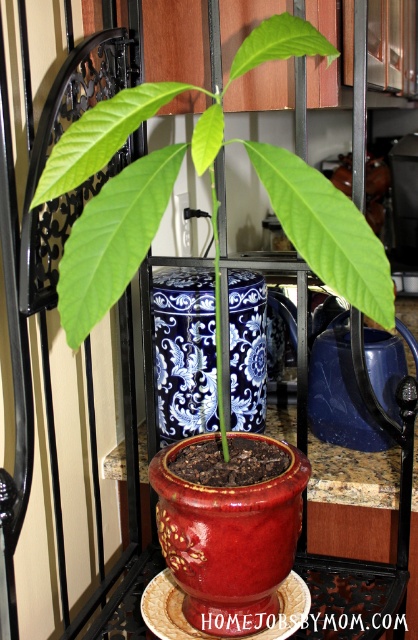
You are a delivery person who needs to place a new package on the counter between the red glossy pot at center and the blue and white porcelain vase at center. The package is 12 inches long. Can you fit it between them without moving either object?

The red glossy pot at center is 11.56 inches away from the blue and white porcelain vase at center, so the 12 inch package cannot fit between them as the distance is slightly less than the package length.

You are arranging plants in a kitchen. You have a red glossy pot at center and a blue and white porcelain vase at center. Which object is positioned lower in the scene?

The red glossy pot at center is located below the blue and white porcelain vase at center, so it is positioned lower in the scene.